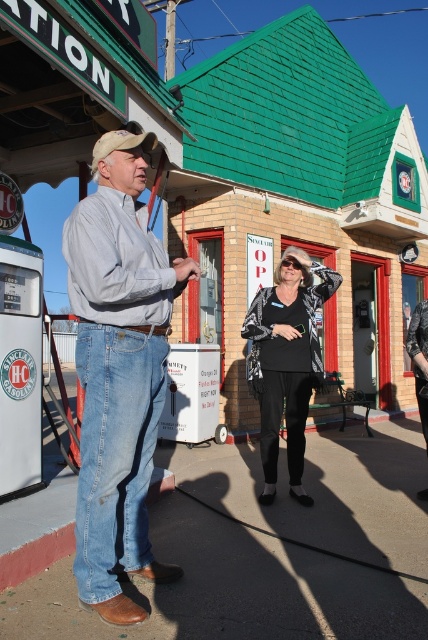
What do you see at coordinates (118, 371) in the screenshot? Image resolution: width=428 pixels, height=640 pixels. I see `denim jeans at left` at bounding box center [118, 371].

The width and height of the screenshot is (428, 640). I want to click on denim jeans at left, so pyautogui.click(x=118, y=371).

The width and height of the screenshot is (428, 640). I want to click on denim jeans at left, so [x=118, y=371].